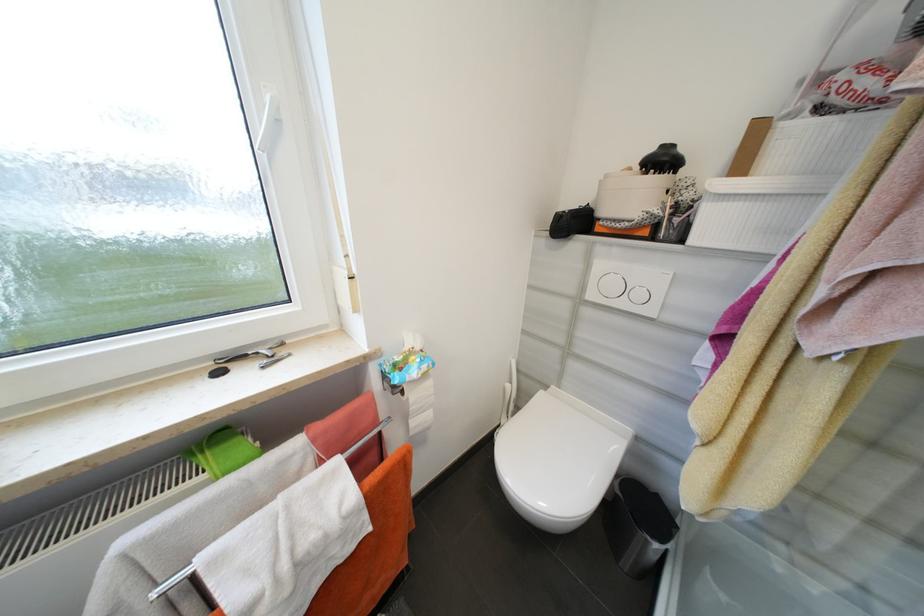
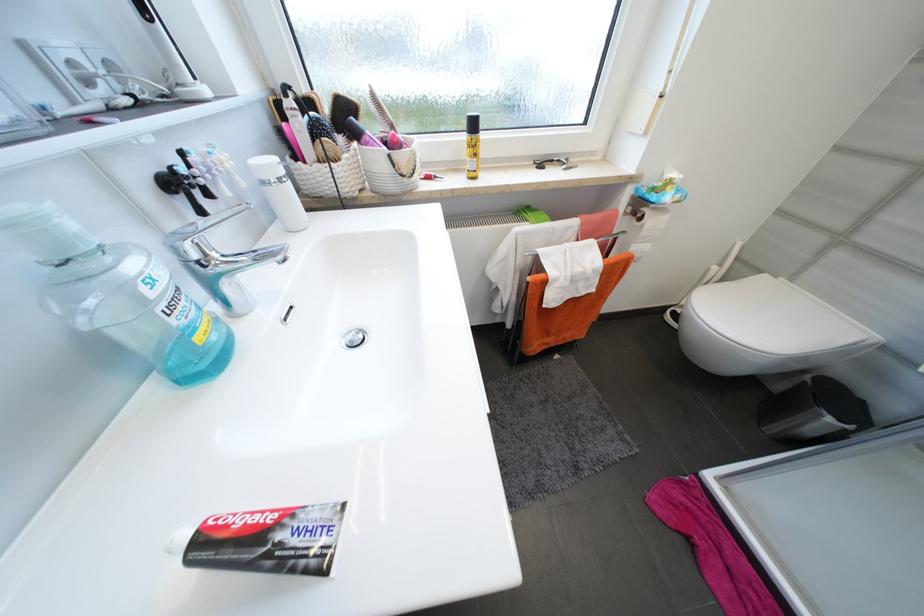
In the second image, find the point that corresponds to point (662, 546) in the first image.

(834, 421)